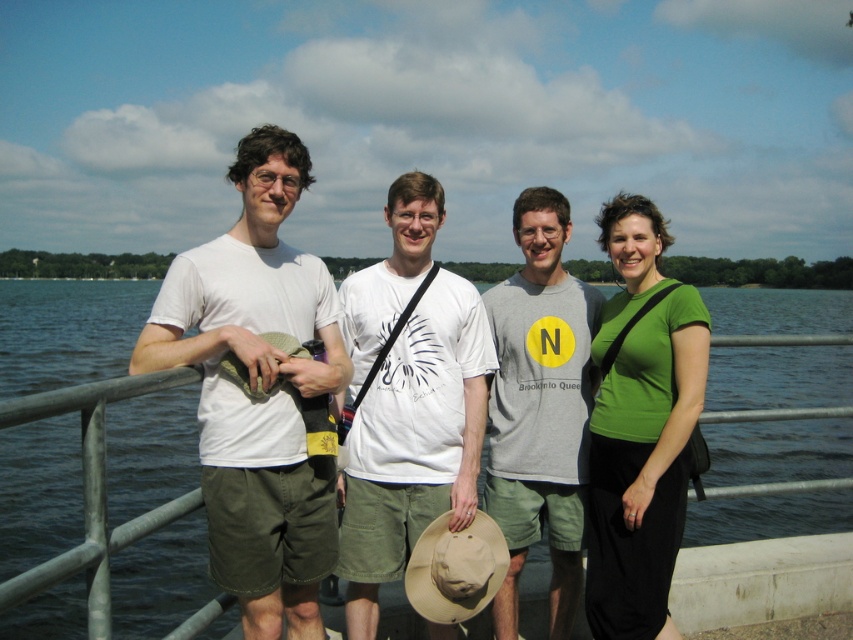
Which is more to the right, blue water at center or white matte t-shirt at center?

white matte t-shirt at center

Locate an element on the screen. The width and height of the screenshot is (853, 640). blue water at center is located at coordinates (67, 332).

Locate an element on the screen. This screenshot has width=853, height=640. blue water at center is located at coordinates (67, 332).

Is white cotton t-shirt at left below white matte t-shirt at center?

No.

How far apart are white cotton t-shirt at left and white matte t-shirt at center?

They are 33.57 inches apart.

Who is more forward, (160, 314) or (372, 552)?

Point (160, 314) is in front.

Where is `white cotton t-shirt at left`? white cotton t-shirt at left is located at coordinates (254, 387).

Who is more distant from viewer, [646,330] or [523,483]?

The point [523,483] is more distant.

Measure the distance from green matte shirt at center to gray cotton t-shirt at center.

green matte shirt at center is 26.74 inches from gray cotton t-shirt at center.

Find the location of a particular element. The width and height of the screenshot is (853, 640). green matte shirt at center is located at coordinates (x=640, y=428).